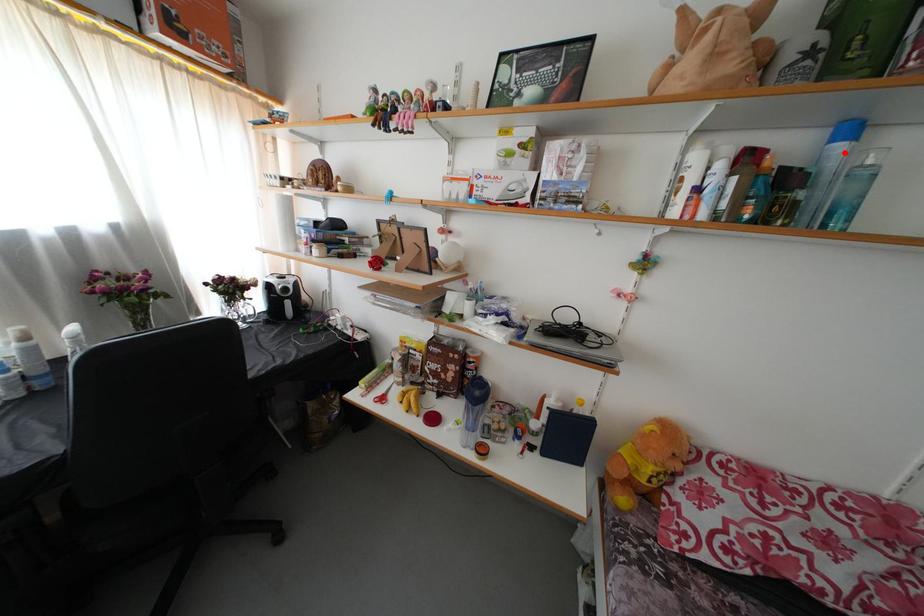
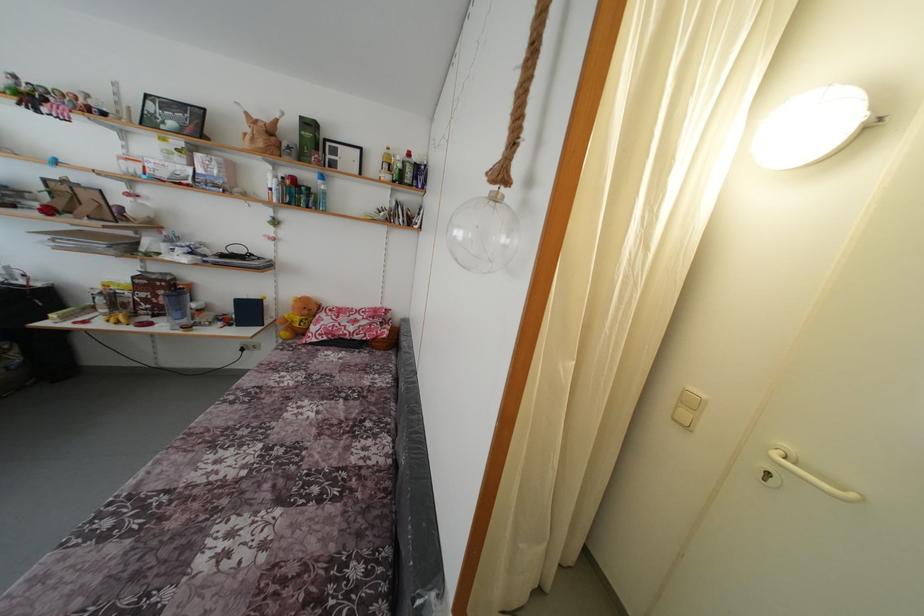
Question: I am providing you with two images of the same scene from different viewpoints. A red point is marked on the first image. Can you still see the location of the red point in image 2?

Choices:
 (A) Yes
 (B) No

Answer: (A)